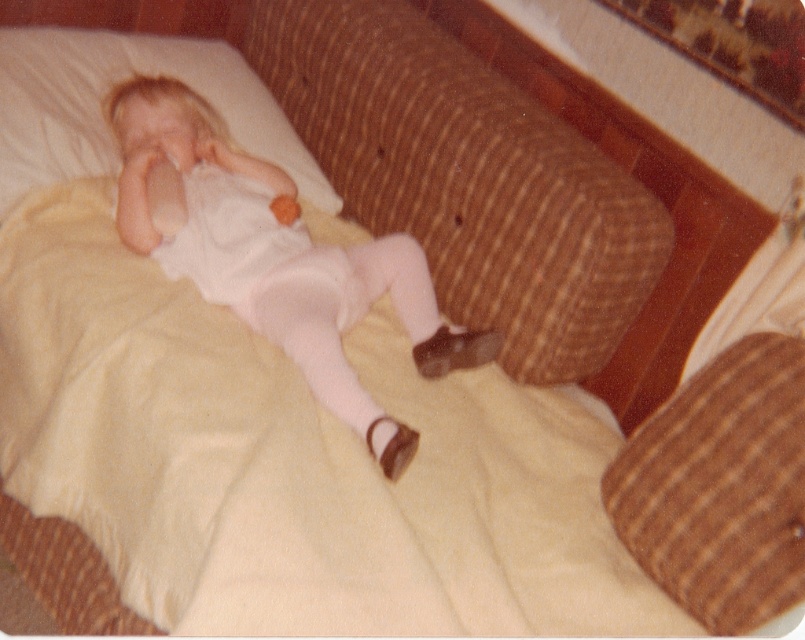
You are a parent checking on your child. You notice the white matte onesie at center and the white soft pillow at upper left. How far apart are these two items from each other?

The white matte onesie at center is 9.54 inches from the white soft pillow at upper left.

You are a parent checking on your child. You see the brown corduroy pillow at center and the white soft pillow at upper left. Which pillow is closer to the headboard?

The white soft pillow at upper left is closer to the headboard because it is positioned at upper left, while the brown corduroy pillow at center is farther away.

You are a parent trying to locate your child who is wearing a white matte onesie at center. Based on the coordinates given, where should you look in the image?

The white matte onesie at center is located at point (x=275, y=257).